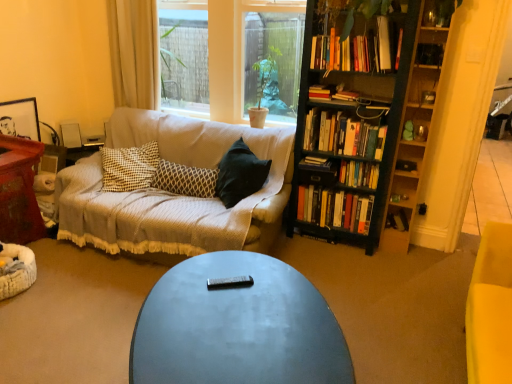
You are a GUI agent. You are given a task and a screenshot of the screen. Output one action in this format:
    pyautogui.click(x=<x>, y=<y>)
    Task: Click on the blank space situated above matte black coffee table at center (from a real-world perspective)
    The height and width of the screenshot is (384, 512).
    Given the screenshot: What is the action you would take?
    pyautogui.click(x=242, y=309)